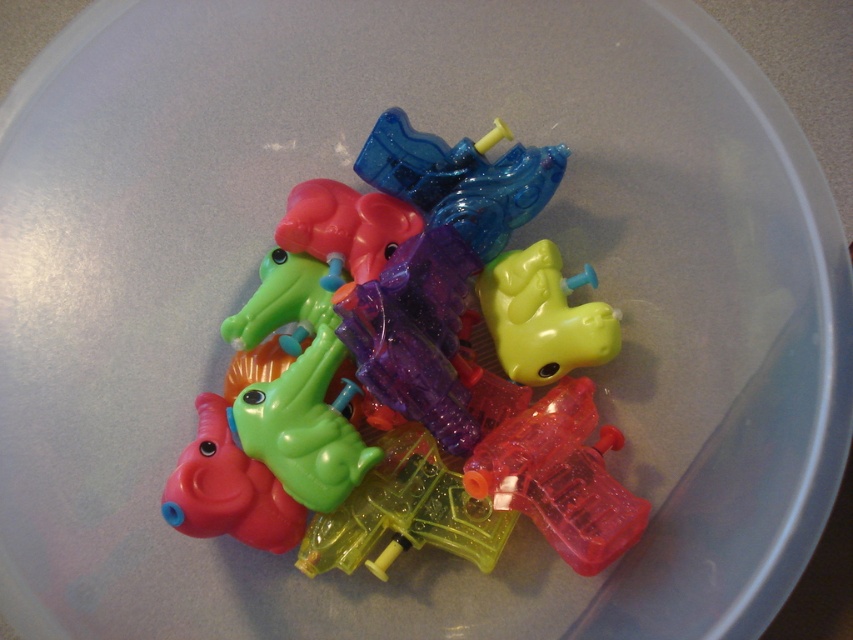
Question: Which point is closer to the camera?

Choices:
 (A) translucent plastic toy at center
 (B) rubberized green crocodile at center

Answer: (A)

Question: Which point is closer to the camera taking this photo?

Choices:
 (A) click(201, 426)
 (B) click(589, 556)
 (C) click(381, 321)

Answer: (B)

Question: Is translucent plastic toy at center positioned behind transparent plastic gun at center?

Choices:
 (A) no
 (B) yes

Answer: (B)

Question: Which object appears closest to the camera in this image?

Choices:
 (A) rubberized green crocodile at center
 (B) translucent plastic toy at center
 (C) transparent plastic gun at center

Answer: (C)

Question: Can you confirm if translucent plastic toy at center is bigger than transparent plastic gun at center?

Choices:
 (A) yes
 (B) no

Answer: (A)

Question: Does translucent plastic toy at center appear on the left side of transparent plastic gun at center?

Choices:
 (A) yes
 (B) no

Answer: (A)